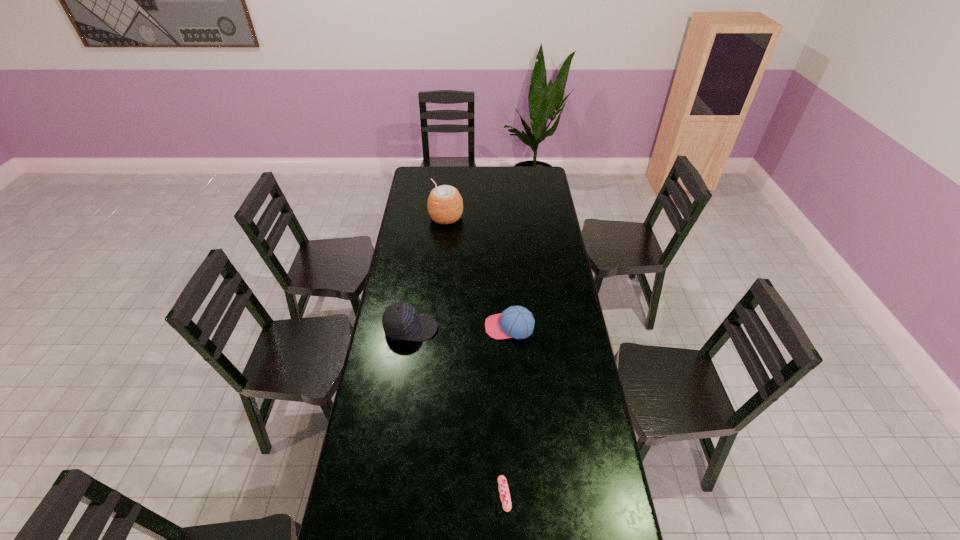
Image resolution: width=960 pixels, height=540 pixels. I want to click on the tallest object, so click(x=445, y=205).

Find the location of `coconut`. coconut is located at coordinates [x=445, y=205].

What are the coordinates of `the left baseball cap` in the screenshot? It's located at (400, 320).

Identify the location of the second tallest object. (400, 320).

The width and height of the screenshot is (960, 540). Identify the location of the shorter baseball cap. (517, 322).

The image size is (960, 540). I want to click on the second shortest object, so click(517, 322).

Identify the location of the nearest object. (505, 498).

The width and height of the screenshot is (960, 540). Identify the location of eclair. (505, 498).

I want to click on free space located 0.170m on the front of the tallest object, so click(444, 249).

At what (x,y) coordinates should I click in order to perform the action: click on free region located 0.330m at the front of the left baseball cap where the brim is located. Please return your answer as a coordinate pair (x, y). Looking at the image, I should click on (516, 329).